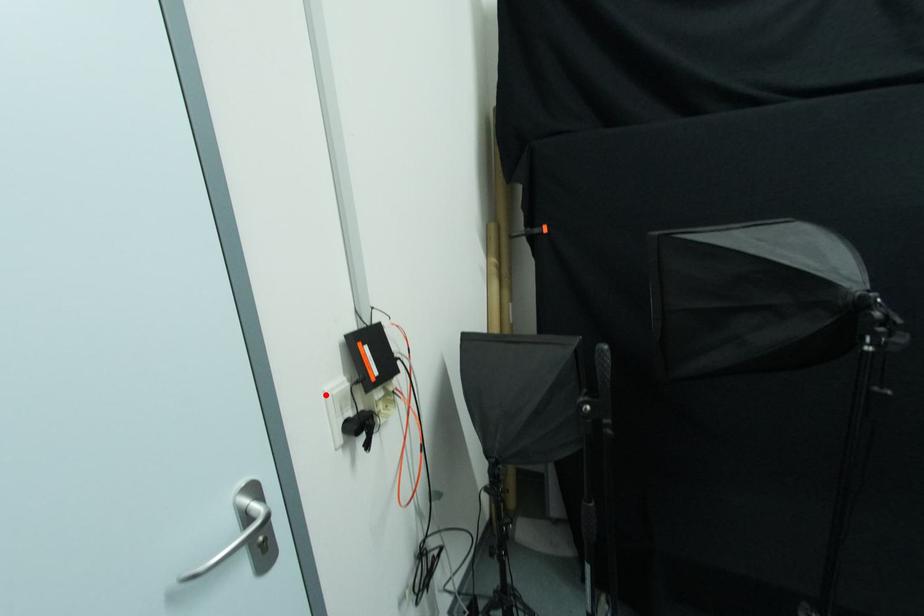
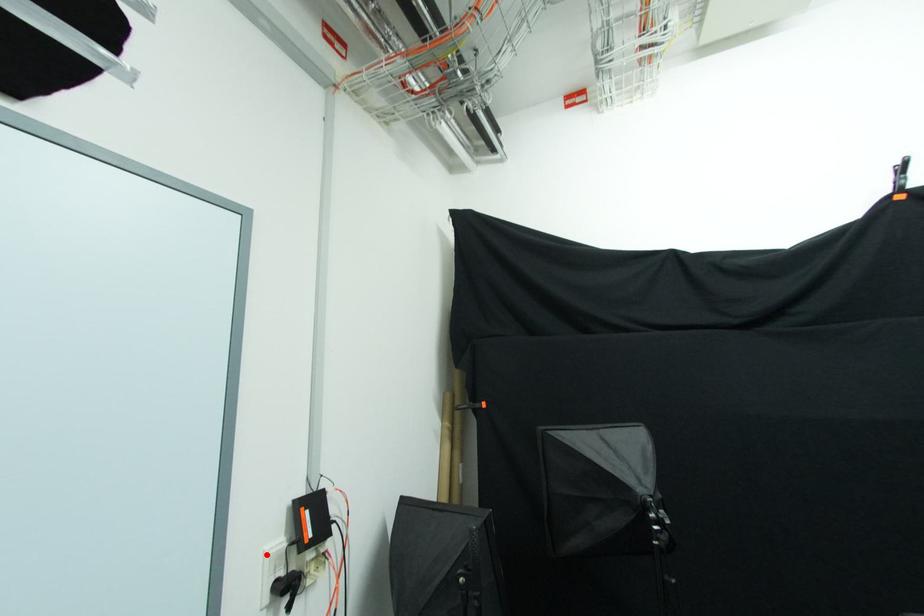
I am providing you with two images of the same scene from different viewpoints. A red point is marked on the first image and another point is marked on the second image. Do the highlighted points in image1 and image2 indicate the same real-world spot?

Yes